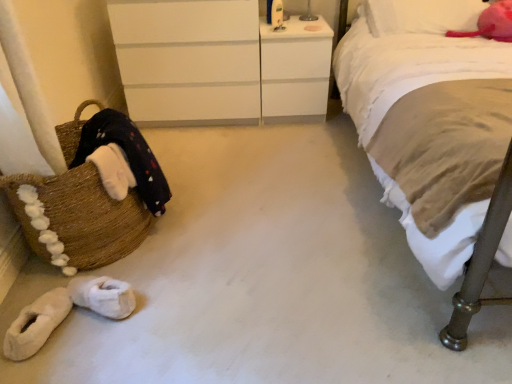
I want to click on empty space that is to the right of white fluffy slippers at lower left, the first footwear positioned from the right, so click(x=160, y=301).